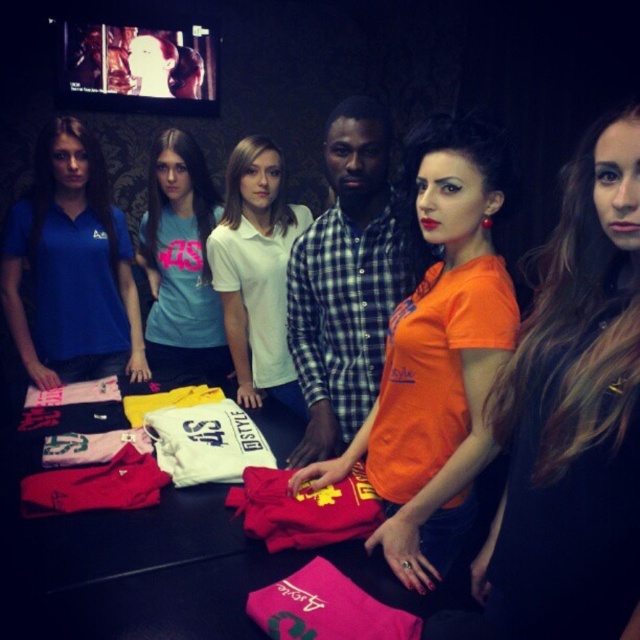
Who is more forward, (90, 364) or (202, 268)?

Point (90, 364) is more forward.

Does blue cotton polo shirt at left have a lesser height compared to light blue t-shirt at center?

Yes, blue cotton polo shirt at left is shorter than light blue t-shirt at center.

Between point (131, 371) and point (193, 358), which one is positioned in front?

Point (131, 371) is in front.

At what (x,y) coordinates should I click in order to perform the action: click on blue cotton polo shirt at left. Please return your answer as a coordinate pair (x, y). The image size is (640, 640). Looking at the image, I should click on (72, 266).

Between point (532, 560) and point (204, 176), which one is positioned behind?

Positioned behind is point (204, 176).

Based on the photo, who is higher up, orange matte shirt at center or light blue t-shirt at center?

light blue t-shirt at center is above.

The width and height of the screenshot is (640, 640). What are the coordinates of `orange matte shirt at center` in the screenshot? It's located at (573, 417).

Identify the location of orange matte shirt at center. (573, 417).

Can you confirm if checkered fabric shirt at center is positioned to the right of white cotton polo shirt at center?

Indeed, checkered fabric shirt at center is positioned on the right side of white cotton polo shirt at center.

Is checkered fabric shirt at center smaller than white cotton polo shirt at center?

Yes, checkered fabric shirt at center is smaller than white cotton polo shirt at center.

Who is more forward, (324, 353) or (294, 225)?

Point (324, 353) is more forward.

This screenshot has height=640, width=640. Identify the location of checkered fabric shirt at center. (346, 282).